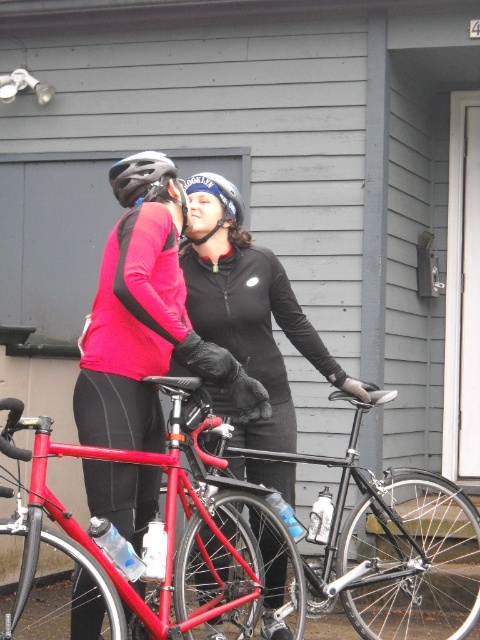
You are a photographer trying to capture a clear shot of both the shiny red frame bicycle at center and the matte black helmet at upper center. Which object should you focus on first to ensure it appears sharp in your photo?

You should focus on the shiny red frame bicycle at center first because it is closer to the viewer than the matte black helmet at upper center, so focusing on the closer object ensures it will be sharp, and the helmet may also be in focus depending on depth of field.

You are standing in front of the residential building and see two points marked in the scene. Which point, point (444, 490) or point (115, 193), is closer to you?

Point (444, 490) is closer to you because it is further to the viewer than point (115, 193).

You are standing at the edge of a park and see a matte black jacket at center. If you want to reach it within 10 seconds, what is the minimum speed you need to walk at?

The matte black jacket at center is 13.19 feet away. To cover this distance in 10 seconds, you would need to walk at a minimum speed of approximately 1.32 feet per second.